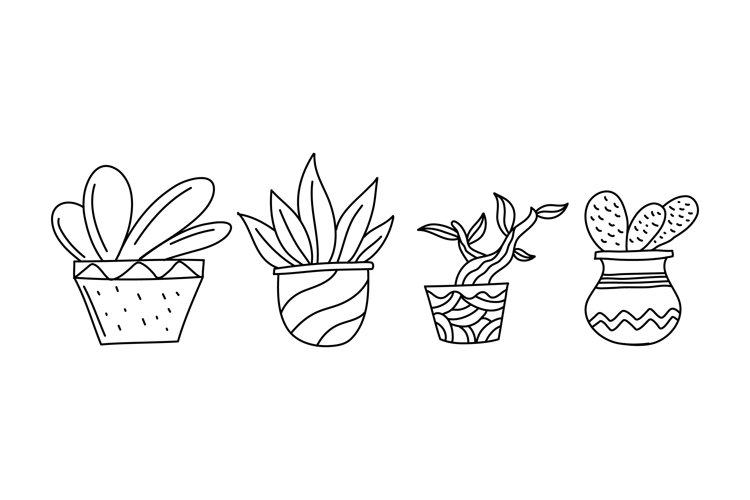
Find the location of a particular element. This screenshot has width=750, height=500. first vase is located at coordinates point(134,291).